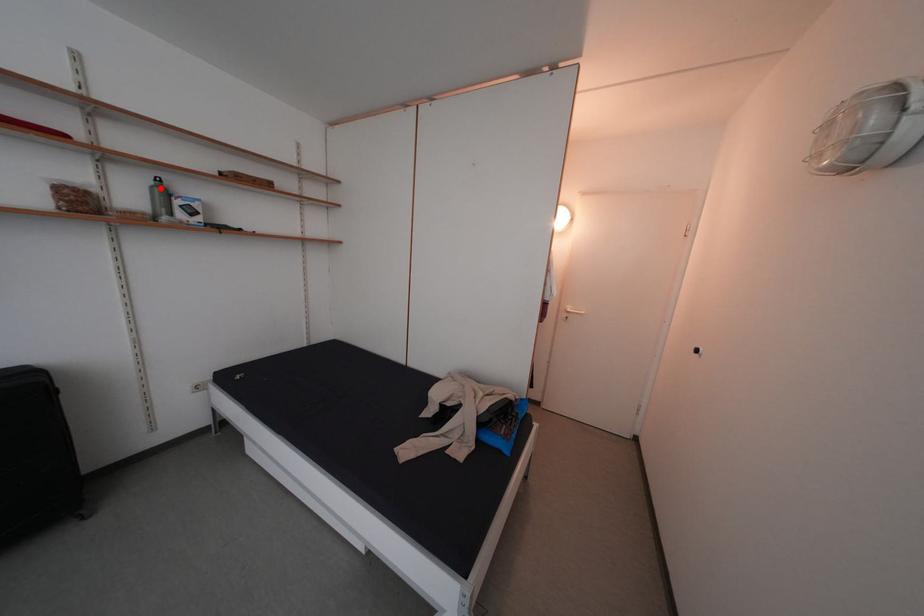
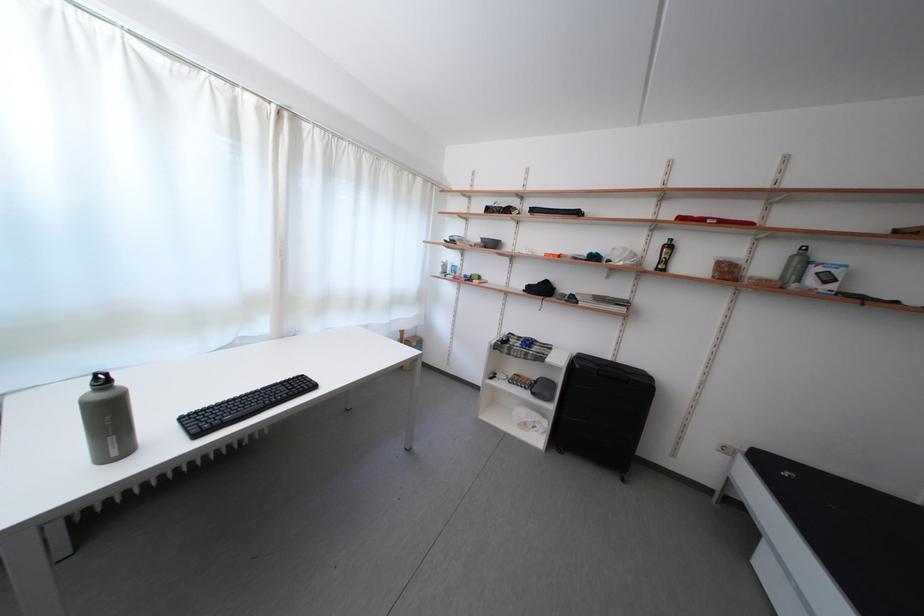
The point at the highlighted location is marked in the first image. Where is the corresponding point in the second image?

(804, 257)